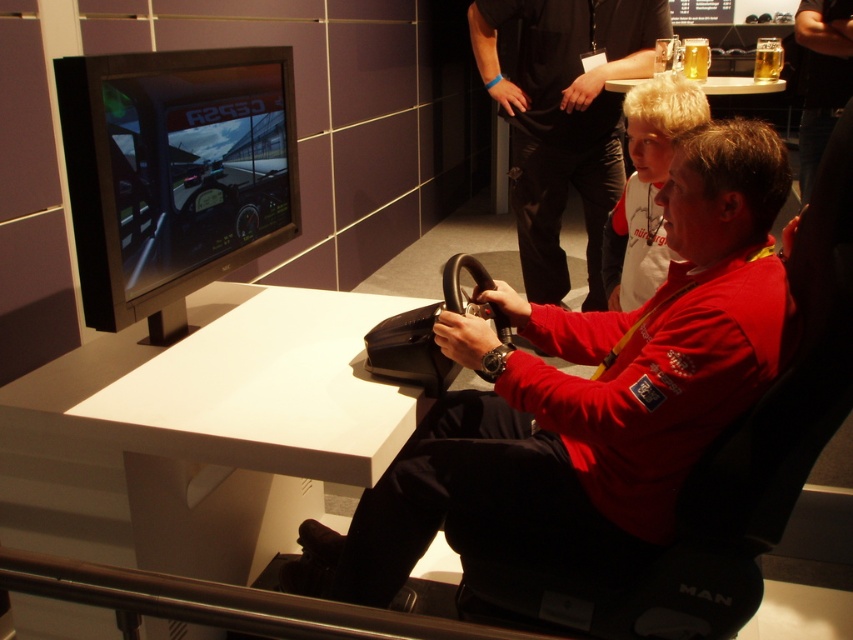
Does matte black steering wheel at center have a larger size compared to matte red shirt at center?

Yes.

Based on the photo, is matte black steering wheel at center to the right of matte red shirt at center from the viewer's perspective?

Incorrect, matte black steering wheel at center is not on the right side of matte red shirt at center.

You are a GUI agent. You are given a task and a screenshot of the screen. Output one action in this format:
    pyautogui.click(x=<x>, y=<y>)
    Task: Click on the matte black steering wheel at center
    The image size is (853, 640).
    Given the screenshot: What is the action you would take?
    pyautogui.click(x=585, y=397)

Can you confirm if matte red shirt at center is taller than white cotton shirt at upper center?

Indeed, matte red shirt at center has a greater height compared to white cotton shirt at upper center.

Does point (531, 198) come behind point (680, 125)?

Yes.

Locate an element on the screen. matte red shirt at center is located at coordinates (564, 118).

In the scene shown: Is matte black steering wheel at center taller than white cotton shirt at upper center?

Yes, matte black steering wheel at center is taller than white cotton shirt at upper center.

Who is positioned more to the right, matte black steering wheel at center or white cotton shirt at upper center?

white cotton shirt at upper center is more to the right.

This screenshot has width=853, height=640. What are the coordinates of `matte black steering wheel at center` in the screenshot? It's located at (585, 397).